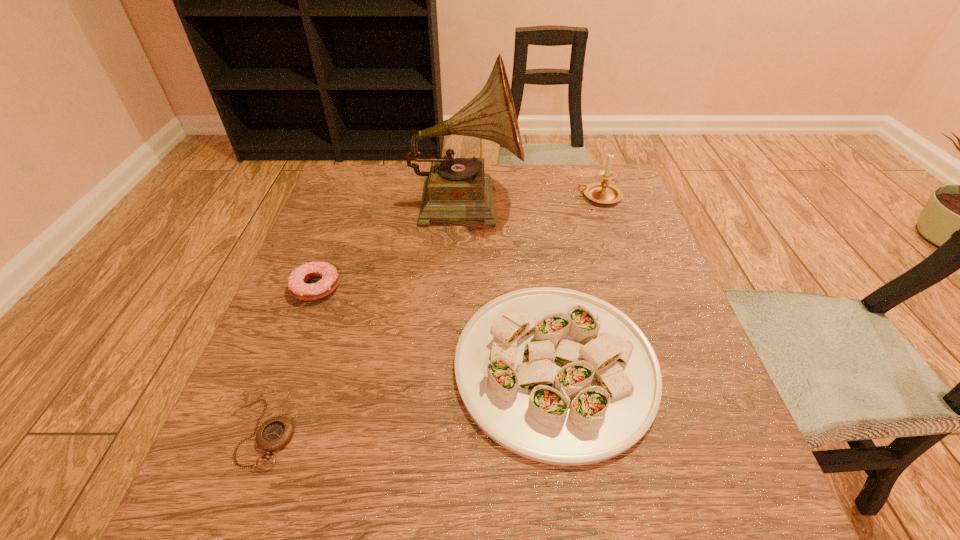
This screenshot has width=960, height=540. Find the location of `object present at the near left corner`. object present at the near left corner is located at coordinates (275, 433).

What are the coordinates of `object present at the far right corner` in the screenshot? It's located at (602, 192).

In order to click on object that is at the near right corner in this screenshot , I will do `click(558, 376)`.

The height and width of the screenshot is (540, 960). I want to click on free space at the far edge, so click(x=413, y=193).

This screenshot has width=960, height=540. I want to click on free space at the left edge of the desktop, so click(x=329, y=325).

You are a GUI agent. You are given a task and a screenshot of the screen. Output one action in this format:
    pyautogui.click(x=<x>, y=<y>)
    Task: Click on the free spot at the right edge of the desktop
    
    Given the screenshot: What is the action you would take?
    pyautogui.click(x=602, y=279)

Find the location of `free location at the near left corner of the desktop`. free location at the near left corner of the desktop is located at coordinates (226, 501).

Where is `vacant space at the far right corner`? This screenshot has width=960, height=540. vacant space at the far right corner is located at coordinates (593, 167).

Find the location of a particular element. The height and width of the screenshot is (540, 960). free point between the candle holder and the platter is located at coordinates (577, 281).

Locate an element on the screen. This screenshot has width=960, height=540. empty space that is in between the tallest object and the pocket watch is located at coordinates pyautogui.click(x=365, y=318).